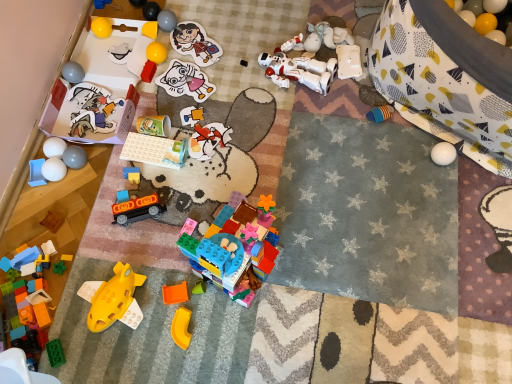
Locate an element on the screen. The height and width of the screenshot is (384, 512). free space between matte blue plastic toy at center, marked as the thirteenth toy in a right-to-left arrangement, and translucent orange plastic toy at center, the fourth toy in the right-to-left sequence is located at coordinates (164, 236).